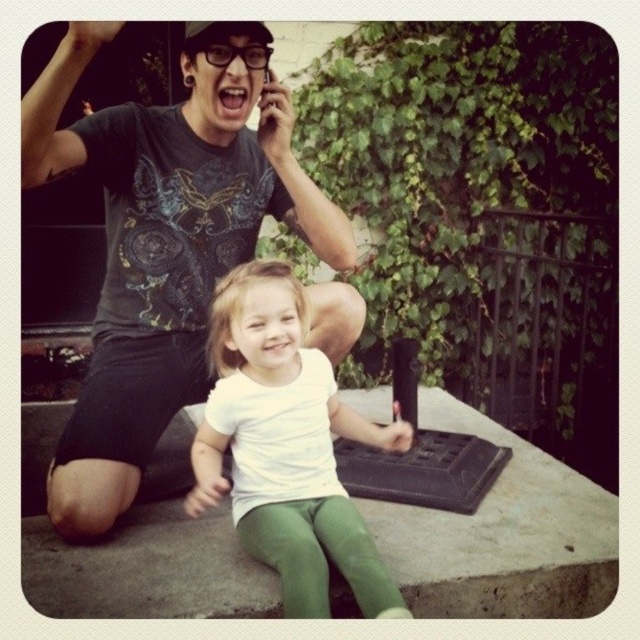
Between point (452, 548) and point (253, 348), which one is positioned in front?

Point (253, 348) is in front.

Is green fabric at lower center thinner than white matte shirt at center?

In fact, green fabric at lower center might be wider than white matte shirt at center.

Is point (572, 484) in front of point (305, 516)?

No, it is not.

Identify the location of green fabric at lower center. This screenshot has width=640, height=640. (502, 536).

Describe the element at coordinates (164, 237) in the screenshot. Image resolution: width=640 pixels, height=640 pixels. I see `matte black t-shirt at upper left` at that location.

Is point (317, 208) farther from viewer compared to point (282, 346)?

Yes, point (317, 208) is behind point (282, 346).

You are a GUI agent. You are given a task and a screenshot of the screen. Output one action in this format:
    pyautogui.click(x=<x>, y=<y>)
    Task: Click on the matte black t-shirt at upper left
    The image size is (640, 640).
    Given the screenshot: What is the action you would take?
    pyautogui.click(x=164, y=237)

Does point (120, 269) come behind point (588, 557)?

That is True.

Which of these two, matte black t-shirt at upper left or green fabric at lower center, stands taller?

Standing taller between the two is matte black t-shirt at upper left.

Where is `matte black t-shirt at upper left`? Image resolution: width=640 pixels, height=640 pixels. matte black t-shirt at upper left is located at coordinates (164, 237).

The height and width of the screenshot is (640, 640). I want to click on matte black t-shirt at upper left, so click(x=164, y=237).